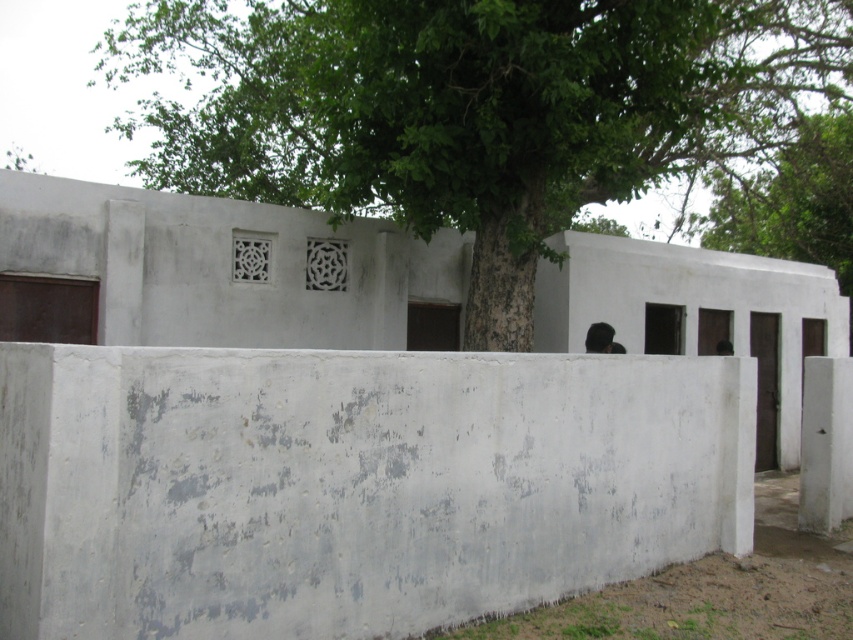
You are standing in front of a gray concrete wall at center that is part of an old building. If you want to place a ladder against it to reach the top, which is 3 meters high, will the ladder you have, which is 3.5 meters long, be sufficient?

The gray concrete wall at center is 3.16 meters away from the viewer. Since the ladder is 3.5 meters long, it can reach the top of the wall which is 3 meters high when placed at this distance.

You are standing in front of the white wall and see the green rough bark tree at center and the green leafy tree at upper center. Which tree is positioned to the left side?

The green rough bark tree at center is positioned to the left of the green leafy tree at upper center.